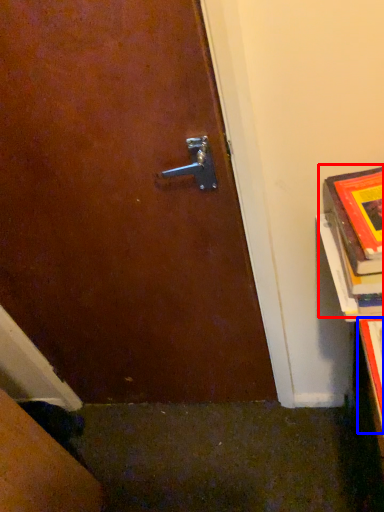
Question: Which point is further to the camera, book (highlighted by a red box) or book cover (highlighted by a blue box)?

Choices:
 (A) book
 (B) book cover

Answer: (A)